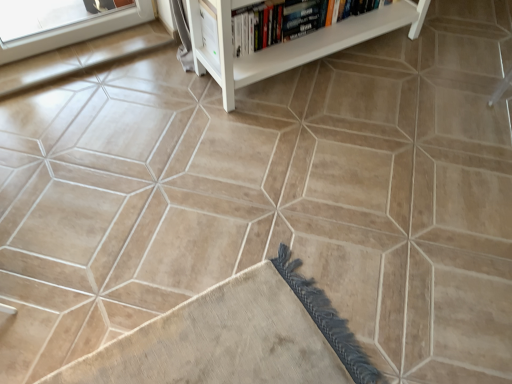
This screenshot has height=384, width=512. Identify the location of vacant space to the right of white matte shelf at upper center. (429, 83).